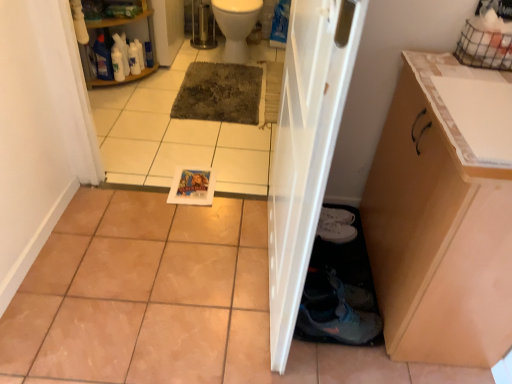
Identify the location of empty space that is ontop of gray textured mat at center. The width and height of the screenshot is (512, 384). (222, 89).